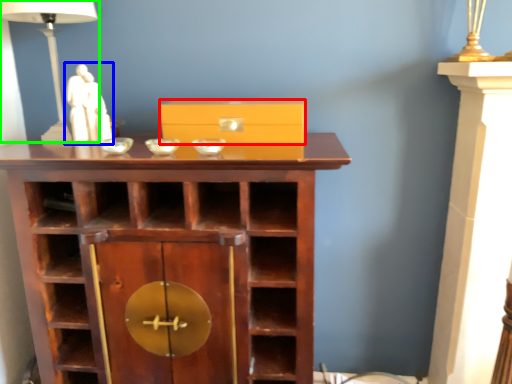
Question: Which object is the closest to the box (highlighted by a red box)? Choose among these: sculpture (highlighted by a blue box) or table lamp (highlighted by a green box).

Choices:
 (A) sculpture
 (B) table lamp

Answer: (A)